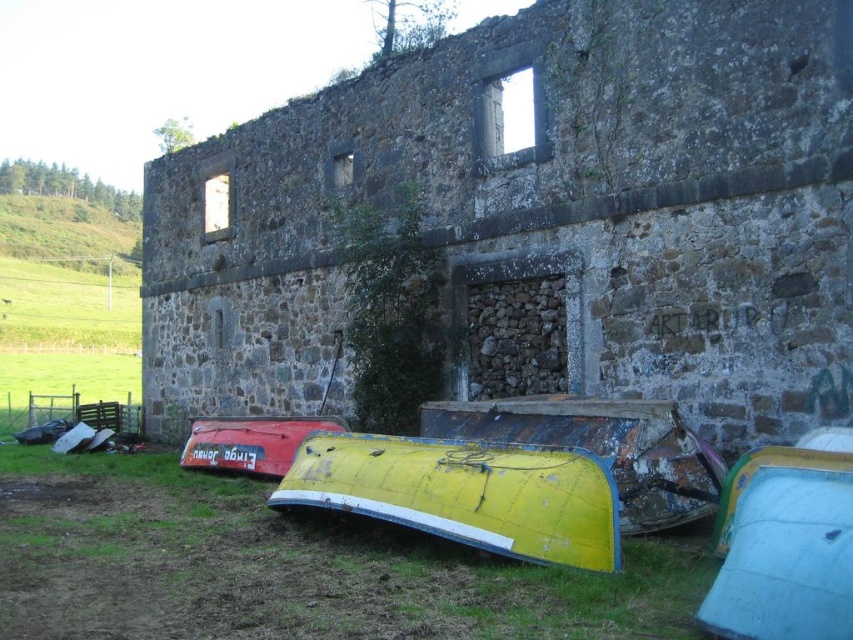
Can you confirm if yellow matte boat at center is positioned below rusty metal boat at lower center?

Yes, yellow matte boat at center is below rusty metal boat at lower center.

Consider the image. Is yellow matte boat at center wider than rusty metal boat at lower center?

Yes.

Locate an element on the screen. Image resolution: width=853 pixels, height=640 pixels. yellow matte boat at center is located at coordinates (465, 493).

Does green grass at lower left appear on the left side of yellow matte boat at center?

Indeed, green grass at lower left is positioned on the left side of yellow matte boat at center.

Can you confirm if green grass at lower left is positioned below yellow matte boat at center?

Indeed, green grass at lower left is positioned under yellow matte boat at center.

What do you see at coordinates (289, 566) in the screenshot? I see `green grass at lower left` at bounding box center [289, 566].

Locate an element on the screen. green grass at lower left is located at coordinates (289, 566).

Based on the photo, can you confirm if green grass at lower left is positioned to the right of red matte boat at lower left?

Indeed, green grass at lower left is positioned on the right side of red matte boat at lower left.

Is point (368, 580) positioned after point (193, 433)?

No, it is not.

I want to click on green grass at lower left, so click(289, 566).